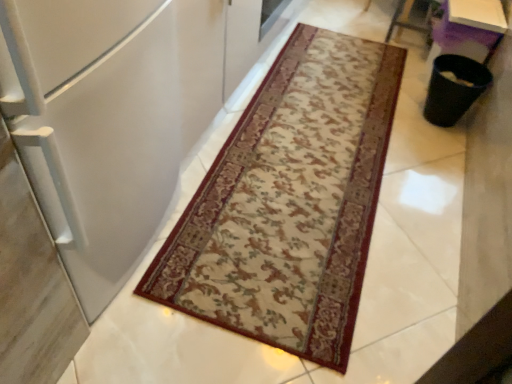
Image resolution: width=512 pixels, height=384 pixels. In order to click on purple plastic table at upper right in this screenshot , I will do `click(468, 29)`.

Locate an element on the screen. The height and width of the screenshot is (384, 512). white matte refrigerator at left is located at coordinates pos(94,127).

Can you confirm if white matte refrigerator at left is bigger than purple plastic table at upper right?

Yes.

What's the angular difference between white matte refrigerator at left and purple plastic table at upper right's facing directions?

The angular difference between white matte refrigerator at left and purple plastic table at upper right is 180 degrees.

Which is further, (156,211) or (445,40)?

The point (445,40) is behind.

Is white matte refrigerator at left to the left or to the right of purple plastic table at upper right in the image?

Clearly, white matte refrigerator at left is on the left of purple plastic table at upper right in the image.

Is point (263, 289) closer or farther from the camera than point (12, 101)?

Point (263, 289).

Is beige carpet with floral pattern at center oriented towards white matte refrigerator at left?

No, beige carpet with floral pattern at center is not oriented towards white matte refrigerator at left.

Considering the positions of objects beige carpet with floral pattern at center and white matte refrigerator at left in the image provided, who is more to the right, beige carpet with floral pattern at center or white matte refrigerator at left?

beige carpet with floral pattern at center is more to the right.

Considering the relative sizes of beige carpet with floral pattern at center and white matte refrigerator at left in the image provided, is beige carpet with floral pattern at center taller than white matte refrigerator at left?

No, beige carpet with floral pattern at center is not taller than white matte refrigerator at left.

Which point is more distant from viewer, (279, 166) or (471, 19)?

Point (471, 19)

From the picture: Considering the sizes of objects beige carpet with floral pattern at center and purple plastic table at upper right in the image provided, who is wider, beige carpet with floral pattern at center or purple plastic table at upper right?

With larger width is beige carpet with floral pattern at center.

How many degrees apart are the facing directions of beige carpet with floral pattern at center and purple plastic table at upper right?

The angle between the facing direction of beige carpet with floral pattern at center and the facing direction of purple plastic table at upper right is 91.9 degrees.

In terms of height, does purple plastic table at upper right look taller or shorter compared to white matte refrigerator at left?

Considering their sizes, purple plastic table at upper right has less height than white matte refrigerator at left.

Does purple plastic table at upper right come in front of white matte refrigerator at left?

No, purple plastic table at upper right is further to the viewer.

Does purple plastic table at upper right appear on the left side of white matte refrigerator at left?

In fact, purple plastic table at upper right is to the right of white matte refrigerator at left.

Is white matte refrigerator at left located outside beige carpet with floral pattern at center?

white matte refrigerator at left lies outside beige carpet with floral pattern at center's area.

Considering the points (84, 48) and (360, 232), which point is behind, point (84, 48) or point (360, 232)?

Positioned behind is point (360, 232).

How different are the orientations of white matte refrigerator at left and beige carpet with floral pattern at center in degrees?

88.1 degrees.

Is white matte refrigerator at left to the right of beige carpet with floral pattern at center from the viewer's perspective?

No, white matte refrigerator at left is not to the right of beige carpet with floral pattern at center.

Does purple plastic table at upper right contain beige carpet with floral pattern at center?

Actually, beige carpet with floral pattern at center is outside purple plastic table at upper right.

Is purple plastic table at upper right wider or thinner than beige carpet with floral pattern at center?

Clearly, purple plastic table at upper right has less width compared to beige carpet with floral pattern at center.

The height and width of the screenshot is (384, 512). In order to click on fridge below the purple plastic table at upper right (from the image's perspective) in this screenshot , I will do pyautogui.click(x=94, y=127).

The height and width of the screenshot is (384, 512). I want to click on fridge on the left side of beige carpet with floral pattern at center, so click(x=94, y=127).

Looking at the image, which one is located closer to purple plastic table at upper right, beige carpet with floral pattern at center or white matte refrigerator at left?

beige carpet with floral pattern at center is closer to purple plastic table at upper right.

Which object lies nearer to the anchor point white matte refrigerator at left, beige carpet with floral pattern at center or purple plastic table at upper right?

beige carpet with floral pattern at center is closer to white matte refrigerator at left.

Which object lies nearer to the anchor point beige carpet with floral pattern at center, purple plastic table at upper right or white matte refrigerator at left?

The object closer to beige carpet with floral pattern at center is white matte refrigerator at left.

Considering their positions, is white matte refrigerator at left positioned closer to beige carpet with floral pattern at center than purple plastic table at upper right?

white matte refrigerator at left.

Estimate the real-world distances between objects in this image. Which object is closer to purple plastic table at upper right, white matte refrigerator at left or beige carpet with floral pattern at center?

Based on the image, beige carpet with floral pattern at center appears to be nearer to purple plastic table at upper right.

Looking at the image, which one is located closer to white matte refrigerator at left, purple plastic table at upper right or beige carpet with floral pattern at center?

Based on the image, beige carpet with floral pattern at center appears to be nearer to white matte refrigerator at left.

Where is `mat between white matte refrigerator at left and purple plastic table at upper right`? The width and height of the screenshot is (512, 384). mat between white matte refrigerator at left and purple plastic table at upper right is located at coordinates (290, 202).